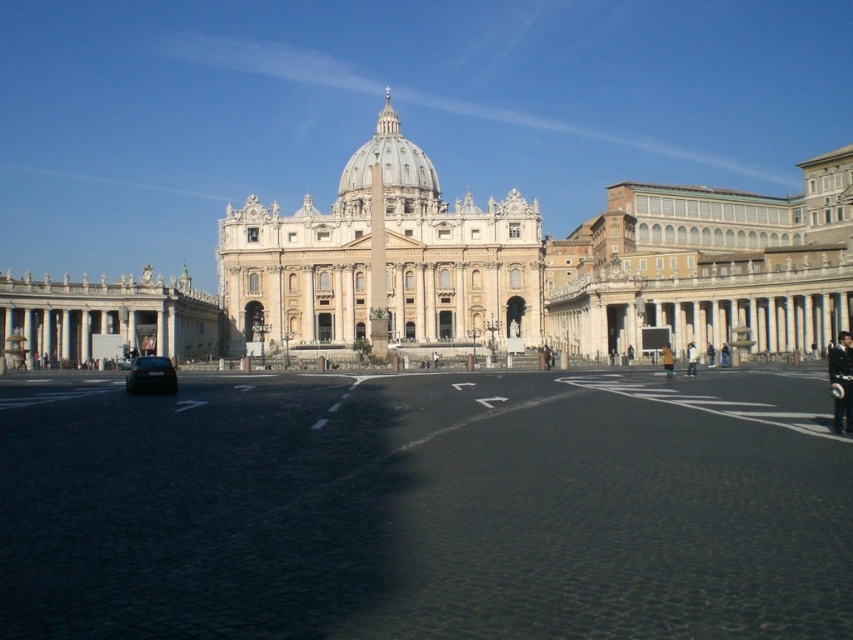
Question: Considering the real-world distances, which object is farthest from the black asphalt at center?

Choices:
 (A) dark uniform at right
 (B) white fabric jacket at center
 (C) golden stone palace at center
 (D) beige stone columns at right

Answer: (C)

Question: Is shiny black car at lower left closer to the viewer compared to light brown leather jacket at right?

Choices:
 (A) no
 (B) yes

Answer: (B)

Question: Is dark uniform at right further to the viewer compared to dark blue jeans at center?

Choices:
 (A) no
 (B) yes

Answer: (A)

Question: Which point is farther from the camera taking this photo?

Choices:
 (A) (238, 316)
 (B) (601, 513)
 (C) (662, 348)
 (D) (547, 282)

Answer: (D)

Question: From the image, what is the correct spatial relationship of black asphalt at center in relation to golden stone palace at center?

Choices:
 (A) right
 (B) left

Answer: (A)

Question: Which of the following is the closest to the observer?

Choices:
 (A) light beige stone columns at left
 (B) black asphalt at center
 (C) golden stone palace at center
 (D) beige stone columns at right

Answer: (B)